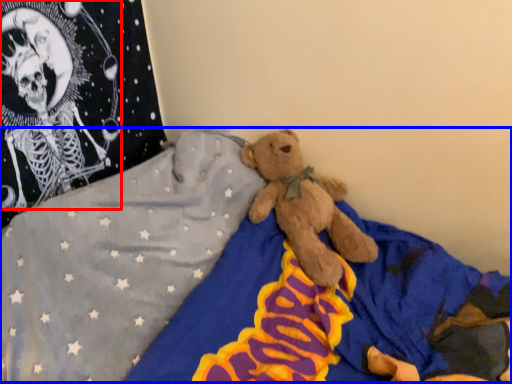
Question: Among these objects, which one is nearest to the camera, toy (highlighted by a red box) or bed (highlighted by a blue box)?

Choices:
 (A) toy
 (B) bed

Answer: (B)